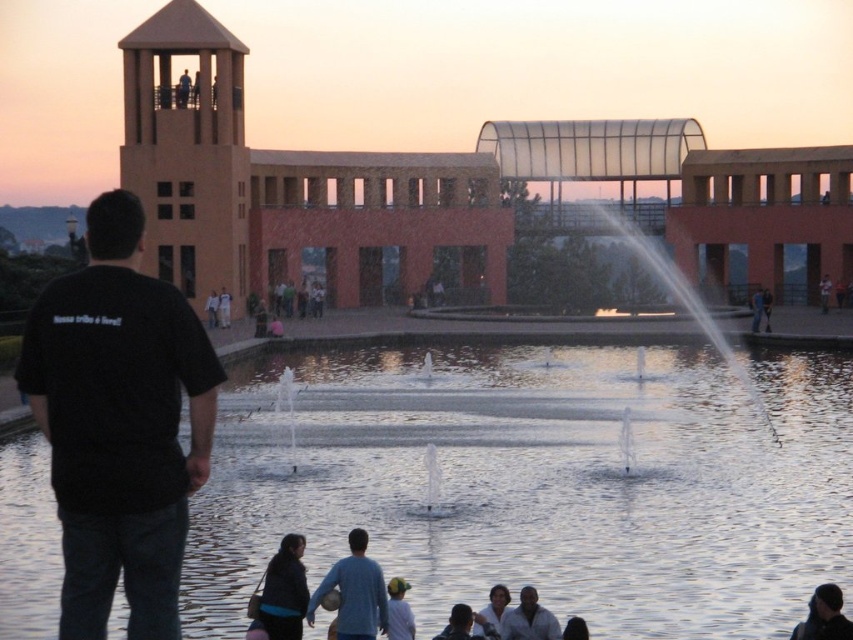
Question: Is blue cotton shirt at lower center below white matte jacket at lower center?

Choices:
 (A) yes
 (B) no

Answer: (B)

Question: Which point is farther to the camera?

Choices:
 (A) blue cotton shirt at lower center
 (B) clear water at center
 (C) white matte jacket at lower center

Answer: (A)

Question: Considering the real-world distances, which object is closest to the white matte jacket at lower center?

Choices:
 (A) blue cotton shirt at lower center
 (B) black cotton t-shirt at left
 (C) smooth black shirt at lower center
 (D) clear water at center

Answer: (C)

Question: Based on their relative distances, which object is nearer to the black cotton t-shirt at left?

Choices:
 (A) white matte jacket at lower center
 (B) smooth black shirt at lower center
 (C) blue cotton shirt at lower center
 (D) clear water at center

Answer: (B)

Question: Is blue cotton shirt at lower center to the right of white matte jacket at lower center from the viewer's perspective?

Choices:
 (A) yes
 (B) no

Answer: (B)

Question: Does black cotton t-shirt at left appear over smooth black shirt at lower center?

Choices:
 (A) yes
 (B) no

Answer: (A)